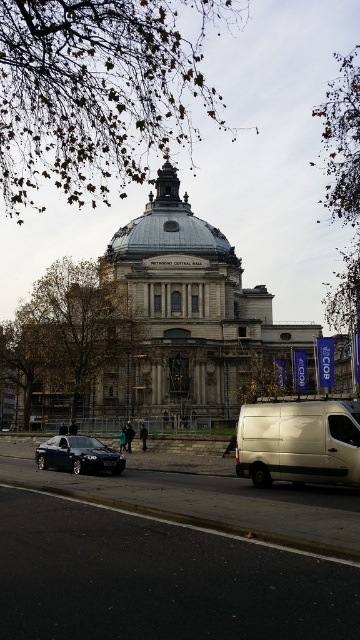
Is silver metallic dome at center further to camera compared to shiny black sedan at lower left?

Yes, silver metallic dome at center is further from the viewer.

Can you confirm if silver metallic dome at center is positioned below shiny black sedan at lower left?

No.

Is point (191, 244) in front of point (87, 468)?

No, (191, 244) is further to viewer.

You are a GUI agent. You are given a task and a screenshot of the screen. Output one action in this format:
    pyautogui.click(x=<x>, y=<y>)
    Task: Click on the silver metallic dome at center
    The image size is (360, 640).
    Given the screenshot: What is the action you would take?
    pyautogui.click(x=168, y=228)

Does silver metallic van at lower right come in front of shiny black sedan at lower left?

Yes, silver metallic van at lower right is in front of shiny black sedan at lower left.

Between silver metallic van at lower right and shiny black sedan at lower left, which one appears on the right side from the viewer's perspective?

From the viewer's perspective, silver metallic van at lower right appears more on the right side.

What are the coordinates of `silver metallic van at lower right` in the screenshot? It's located at pyautogui.click(x=299, y=442).

What are the coordinates of `silver metallic van at lower right` in the screenshot? It's located at (299, 442).

Between silver metallic van at lower right and silver metallic dome at center, which one appears on the left side from the viewer's perspective?

Positioned to the left is silver metallic dome at center.

Can you confirm if silver metallic van at lower right is positioned above silver metallic dome at center?

No.

Describe the element at coordinates (299, 442) in the screenshot. I see `silver metallic van at lower right` at that location.

This screenshot has height=640, width=360. Find the location of `silver metallic van at lower right`. silver metallic van at lower right is located at coordinates (299, 442).